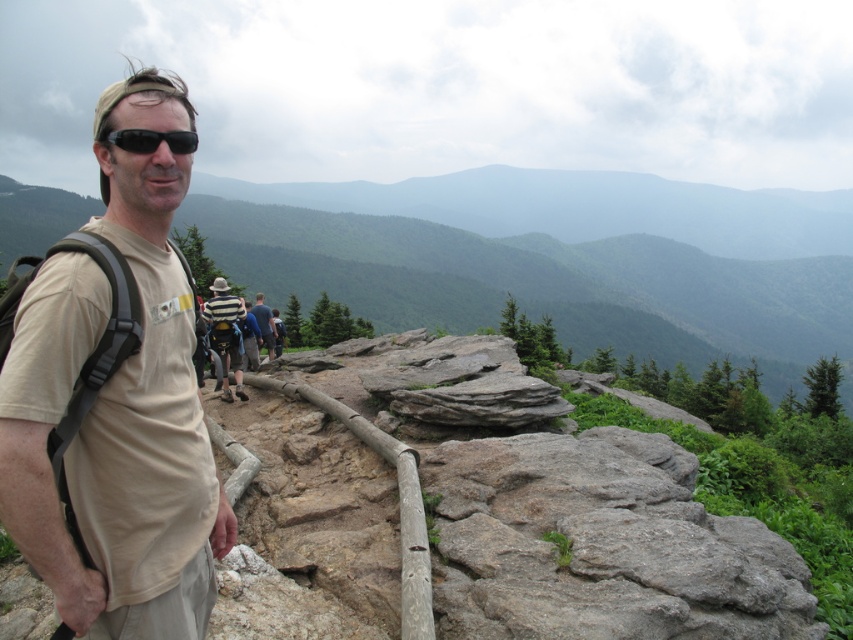
You are a photographer trying to capture a candid shot of the hiker in the tan fabric shirt at left without them noticing. Your camera is currently 1.99 meters away from the hiker. Is the distance sufficient to take the photo without being detected?

The tan fabric shirt at left and camera are 1.99 meters apart from each other. This distance is close enough that the hiker might notice the photographer, so it may not be sufficient for a candid shot without being detected.

You are a photographer trying to capture the hiker in the scene. The striped cotton shirt at center and black matte sunglasses at center are both important for the shot. Since you want to ensure both are clearly visible, which object should you focus on first to account for their size?

The striped cotton shirt at center has a larger size compared to the black matte sunglasses at center, so you should focus on the striped cotton shirt at center first to ensure its details are sharp before adjusting for the smaller sunglasses.